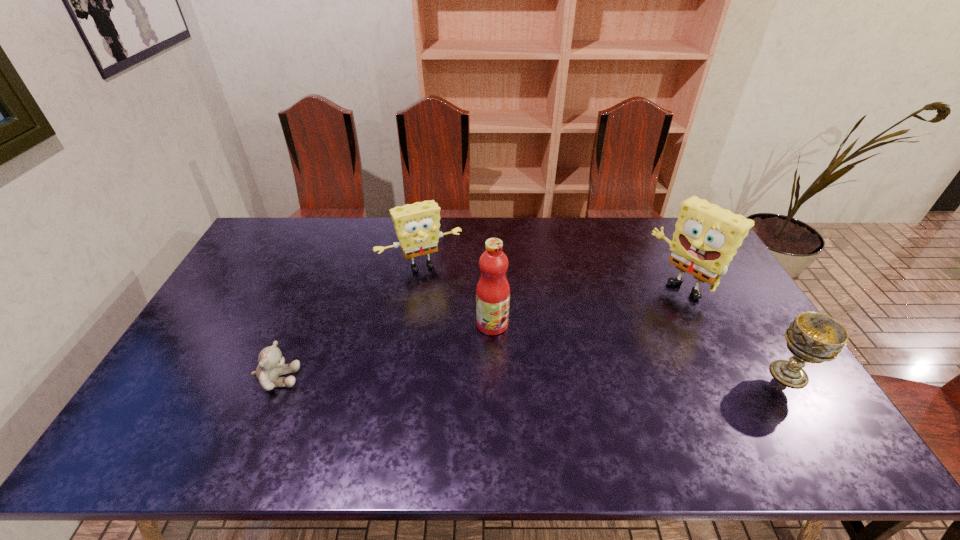
This screenshot has width=960, height=540. In order to click on free spot on the desktop that is between the leftmost object and the rightmost object and is positioned on the face of the third shortest object in this screenshot , I will do `click(477, 377)`.

Find the location of a particular element. free spot on the desktop that is between the shortest object and the rightmost object and is positioned on the face of the right sponge is located at coordinates (571, 376).

Image resolution: width=960 pixels, height=540 pixels. Find the location of `free space on the desktop that is between the shortest object and the fourth tallest object and is positioned on the front label of the fruit juice`. free space on the desktop that is between the shortest object and the fourth tallest object and is positioned on the front label of the fruit juice is located at coordinates (555, 376).